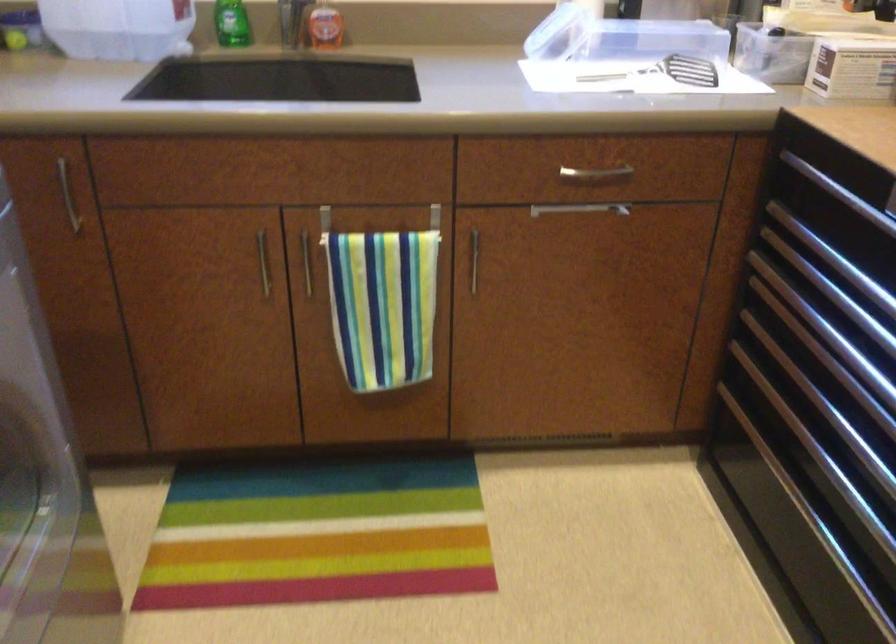
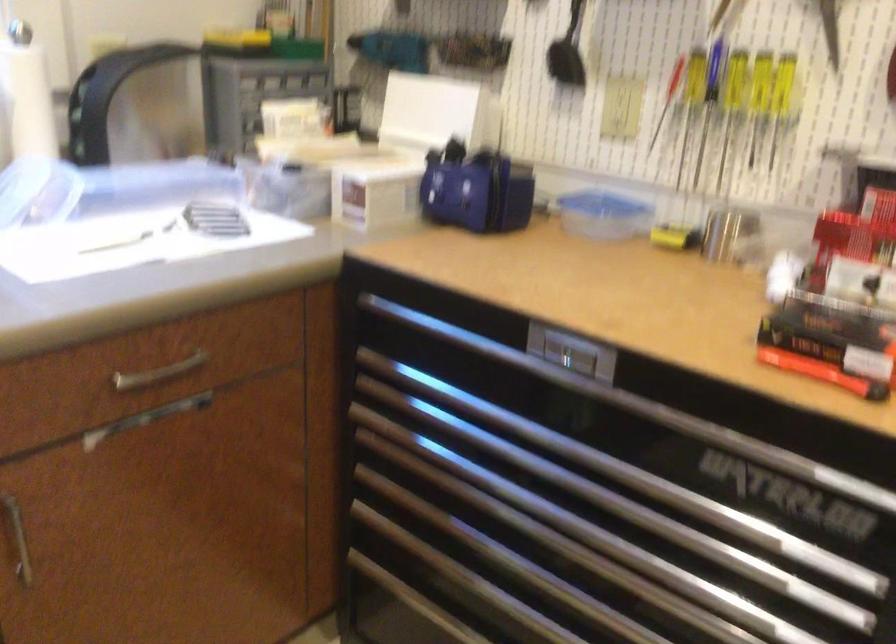
Question: The images are taken continuously from a first-person perspective. In which direction is your viewpoint rotating?

Choices:
 (A) Left
 (B) Right
 (C) Up
 (D) Down

Answer: (B)